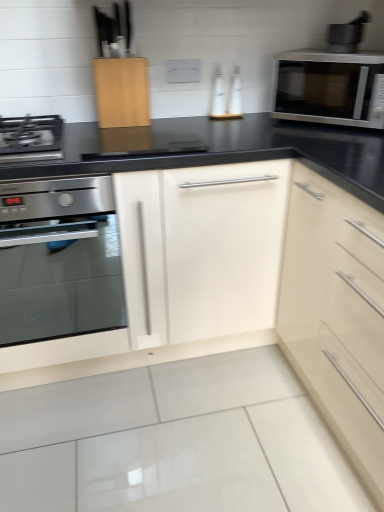
Question: Considering the positions of satin silver microwave at upper right and metallic gray mortar and pestle at upper right in the image, is satin silver microwave at upper right taller or shorter than metallic gray mortar and pestle at upper right?

Choices:
 (A) short
 (B) tall

Answer: (B)

Question: From a real-world perspective, is satin silver microwave at upper right positioned above or below metallic gray mortar and pestle at upper right?

Choices:
 (A) above
 (B) below

Answer: (B)

Question: Which object is positioned closest to the metallic gray mortar and pestle at upper right?

Choices:
 (A) satin stainless steel oven at left
 (B) satin silver microwave at upper right

Answer: (B)

Question: Which is farther from the satin stainless steel oven at left?

Choices:
 (A) satin silver microwave at upper right
 (B) metallic gray mortar and pestle at upper right

Answer: (B)